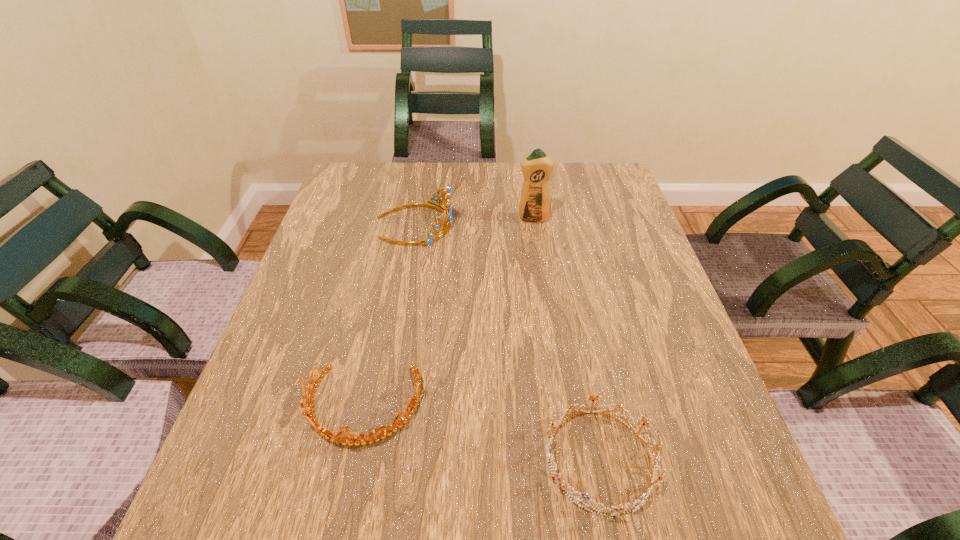
Locate an element on the screen. object that is at the near edge is located at coordinates (620, 510).

Locate an element on the screen. object present at the right edge is located at coordinates (620, 510).

The image size is (960, 540). In order to click on object that is at the far left corner in this screenshot , I will do `click(447, 211)`.

Identify the location of object present at the near right corner. (620, 510).

In the image, there is a desktop. In order to click on vacant space at the far edge in this screenshot , I will do `click(412, 179)`.

The image size is (960, 540). I want to click on free space at the near edge of the desktop, so point(318,507).

At what (x,y) coordinates should I click in order to perform the action: click on free space at the left edge of the desktop. Please return your answer as a coordinate pair (x, y). Looking at the image, I should click on [x=362, y=253].

Locate an element on the screen. The image size is (960, 540). free space at the right edge of the desktop is located at coordinates (646, 258).

Locate an element on the screen. free space at the far right corner of the desktop is located at coordinates (594, 186).

Locate an element on the screen. The height and width of the screenshot is (540, 960). free spot at the near right corner of the desktop is located at coordinates (712, 521).